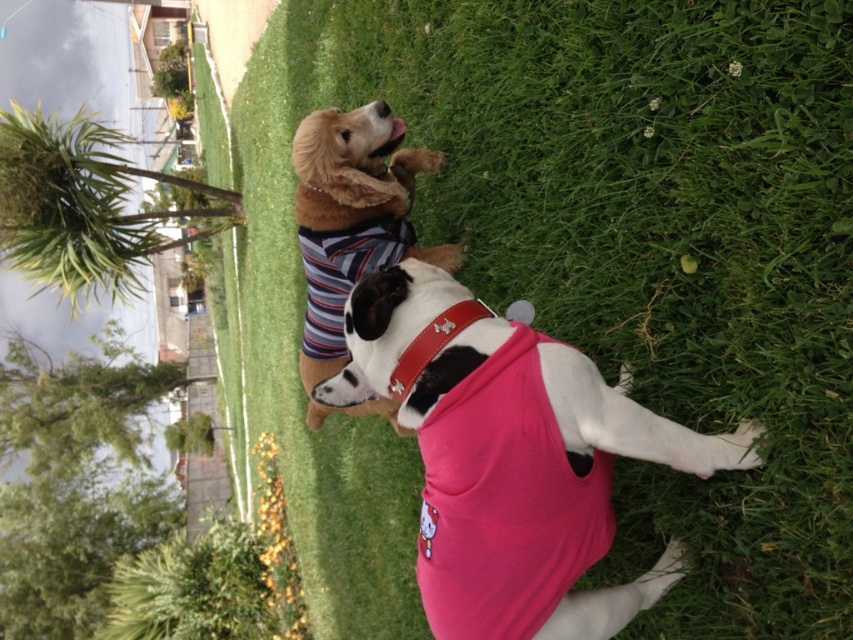
You are standing at the camera position and want to throw a ball to a spot exactly 2 meters away. Is the point at coordinates point (x=393, y=384) within your target range?

The point point (x=393, y=384) is 2.34 meters from the camera, which is beyond the 2 meters target range, so it is not within range.

You are standing in front of the two dogs and want to know which point is closer to you. The points are labeled as point (x=351, y=308) and point (x=351, y=412). Which point is closer to you?

Point (x=351, y=308) is closer to the camera than point (x=351, y=412).